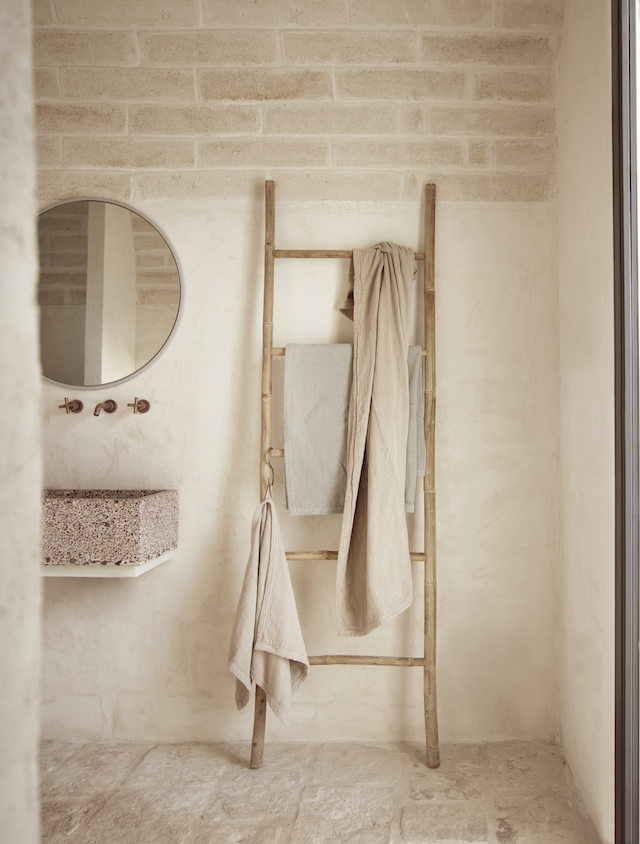
At what (x,y) coordinates should I click in order to perform the action: click on mirror. Please return your answer as a coordinate pair (x, y). This screenshot has height=844, width=640. Looking at the image, I should click on (95, 278).